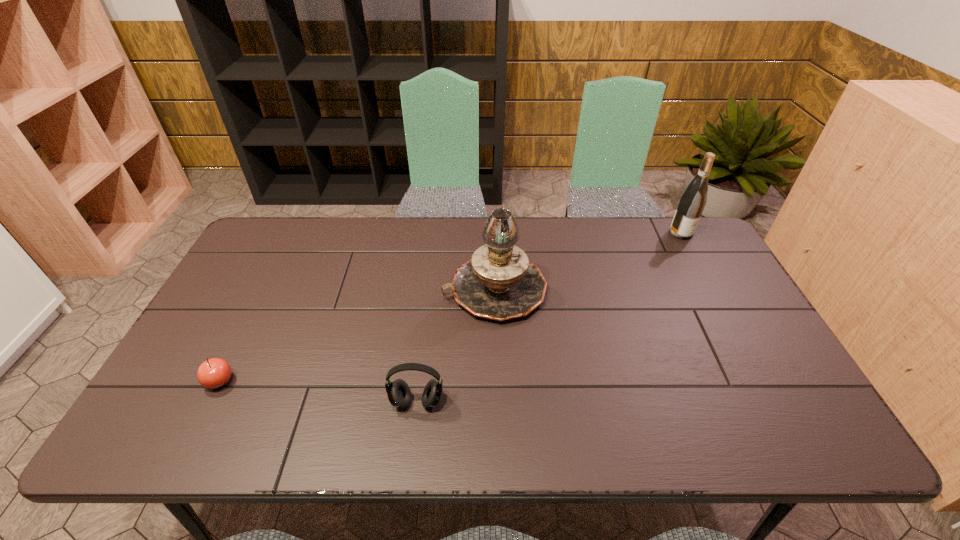
Where is `vacant space that's between the third tallest object and the shortest object`? This screenshot has height=540, width=960. vacant space that's between the third tallest object and the shortest object is located at coordinates (319, 391).

Image resolution: width=960 pixels, height=540 pixels. In order to click on free space that is in between the second shortest object and the oil lamp in this screenshot , I will do click(456, 346).

I want to click on object that can be found as the third closest to the oil lamp, so click(213, 373).

Find the location of a particular element. The height and width of the screenshot is (540, 960). object that stands as the closest to the rightmost object is located at coordinates (x=498, y=282).

What are the coordinates of `vacant space that satisfies the following two spatial constraints: 1. on the back side of the second farthest object; 2. on the right side of the farthest object` in the screenshot? It's located at (492, 233).

Find the location of a particular element. This screenshot has width=960, height=540. blank space that satisfies the following two spatial constraints: 1. on the back side of the shortest object; 2. on the left side of the third nearest object is located at coordinates (266, 289).

Identify the location of vacant space that satisfies the following two spatial constraints: 1. on the back side of the oil lamp; 2. on the left side of the farthest object. The height and width of the screenshot is (540, 960). (492, 233).